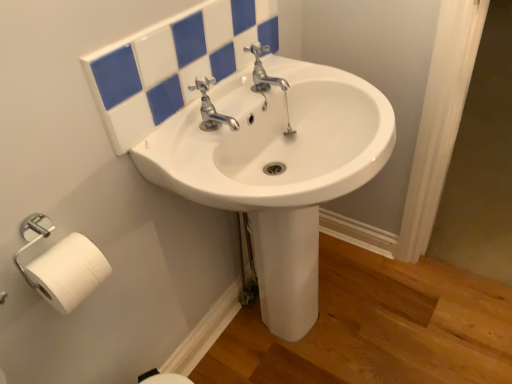
Where is `free space that is to the left of chrome metallic faucet at center`? free space that is to the left of chrome metallic faucet at center is located at coordinates (182, 144).